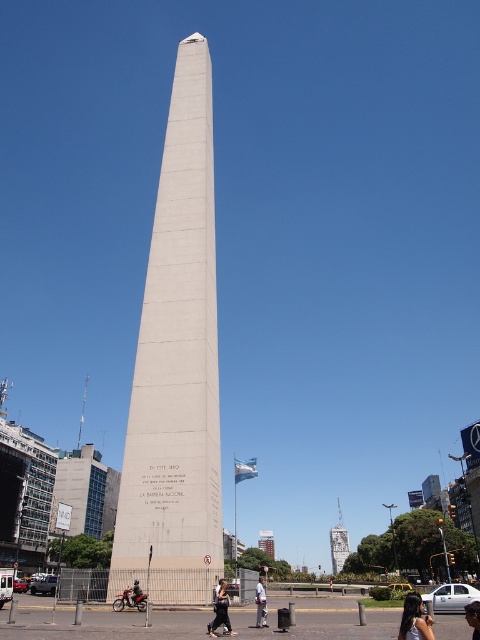
Which is more to the right, white concrete obelisk at center or white cotton shirt at center?

white cotton shirt at center

Is white concrete obelisk at center to the left of white cotton shirt at center from the viewer's perspective?

Indeed, white concrete obelisk at center is positioned on the left side of white cotton shirt at center.

The height and width of the screenshot is (640, 480). Describe the element at coordinates (177, 369) in the screenshot. I see `white concrete obelisk at center` at that location.

Identify the location of white concrete obelisk at center. (177, 369).

Is point (409, 612) closer to viewer compared to point (470, 618)?

Yes, point (409, 612) is in front of point (470, 618).

Is dark brown hair at lower right shorter than dark hair at center?

In fact, dark brown hair at lower right may be taller than dark hair at center.

Is point (412, 604) behind point (474, 636)?

Yes, point (412, 604) is behind point (474, 636).

The image size is (480, 640). In order to click on dark brown hair at lower right in this screenshot , I will do `click(415, 620)`.

Between dark brown hair at lower right and white cotton shirt at center, which one has more height?

white cotton shirt at center

Which is in front, point (427, 620) or point (264, 621)?

Point (427, 620) is in front.

The height and width of the screenshot is (640, 480). Identify the location of dark brown hair at lower right. (415, 620).

Image resolution: width=480 pixels, height=640 pixels. In order to click on dark brown hair at lower right in this screenshot , I will do `click(415, 620)`.